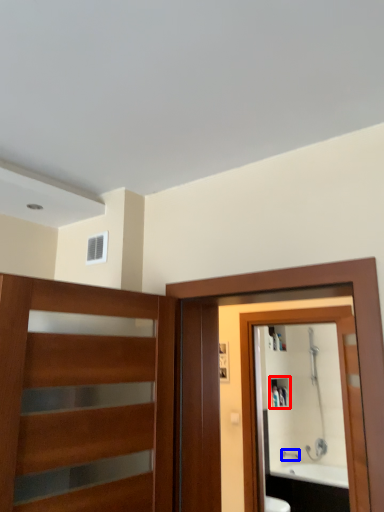
Question: Which object is closer to the camera taking this photo, cabinet (highlighted by a red box) or faucet (highlighted by a blue box)?

Choices:
 (A) cabinet
 (B) faucet

Answer: (B)